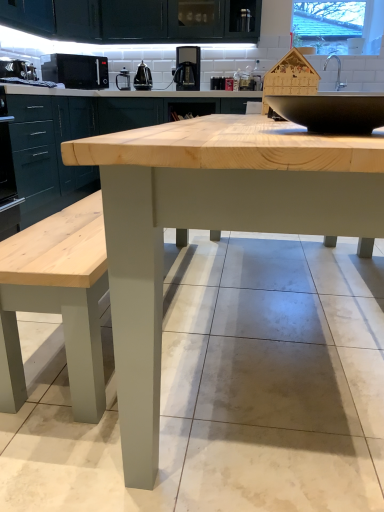
Question: Considering the relative sizes of natural wood table at center and black matte microwave at upper left, which is counted as the 2th appliance, starting from the front, in the image provided, is natural wood table at center shorter than black matte microwave at upper left, which is counted as the 2th appliance, starting from the front,?

Choices:
 (A) no
 (B) yes

Answer: (A)

Question: Does natural wood table at center have a smaller size compared to black matte microwave at upper left, the third appliance in the back-to-front sequence?

Choices:
 (A) no
 (B) yes

Answer: (A)

Question: Does natural wood table at center have a greater width compared to black matte microwave at upper left, the third appliance in the back-to-front sequence?

Choices:
 (A) no
 (B) yes

Answer: (B)

Question: From the image's perspective, is natural wood table at center on top of black matte microwave at upper left, the third appliance in the back-to-front sequence?

Choices:
 (A) yes
 (B) no

Answer: (B)

Question: Would you say natural wood table at center is a long distance from black matte microwave at upper left, arranged as the 3th appliance when viewed from the right?

Choices:
 (A) yes
 (B) no

Answer: (A)

Question: Considering the positions of matte black coffee maker at upper center, marked as the second appliance in a right-to-left arrangement, and transparent glass window at upper right in the image, is matte black coffee maker at upper center, marked as the second appliance in a right-to-left arrangement, taller or shorter than transparent glass window at upper right?

Choices:
 (A) short
 (B) tall

Answer: (A)

Question: Is point tap(129, 74) closer or farther from the camera than point tap(294, 29)?

Choices:
 (A) farther
 (B) closer

Answer: (B)

Question: Based on their sizes in the image, would you say matte black coffee maker at upper center, which is the 3th appliance from left to right, is bigger or smaller than transparent glass window at upper right?

Choices:
 (A) small
 (B) big

Answer: (A)

Question: Considering the positions of matte black coffee maker at upper center, which is the 3th appliance from left to right, and transparent glass window at upper right in the image, is matte black coffee maker at upper center, which is the 3th appliance from left to right, wider or thinner than transparent glass window at upper right?

Choices:
 (A) wide
 (B) thin

Answer: (B)

Question: From a real-world perspective, is natural wood table at center above or below satin black coffee machine at upper center?

Choices:
 (A) above
 (B) below

Answer: (B)

Question: Visually, is natural wood table at center positioned to the left or to the right of satin black coffee machine at upper center?

Choices:
 (A) right
 (B) left

Answer: (A)

Question: From their relative heights in the image, would you say natural wood table at center is taller or shorter than satin black coffee machine at upper center?

Choices:
 (A) tall
 (B) short

Answer: (A)

Question: Does point (369, 233) appear closer or farther from the camera than point (193, 75)?

Choices:
 (A) closer
 (B) farther

Answer: (A)

Question: Is black matte microwave at upper left, arranged as the 3th appliance when viewed from the right, taller or shorter than matte black coffee maker at upper center, which is the 3th appliance from left to right?

Choices:
 (A) short
 (B) tall

Answer: (B)

Question: In the image, is black matte microwave at upper left, the third appliance in the back-to-front sequence, on the left side or the right side of matte black coffee maker at upper center, marked as the second appliance in a right-to-left arrangement?

Choices:
 (A) left
 (B) right

Answer: (A)